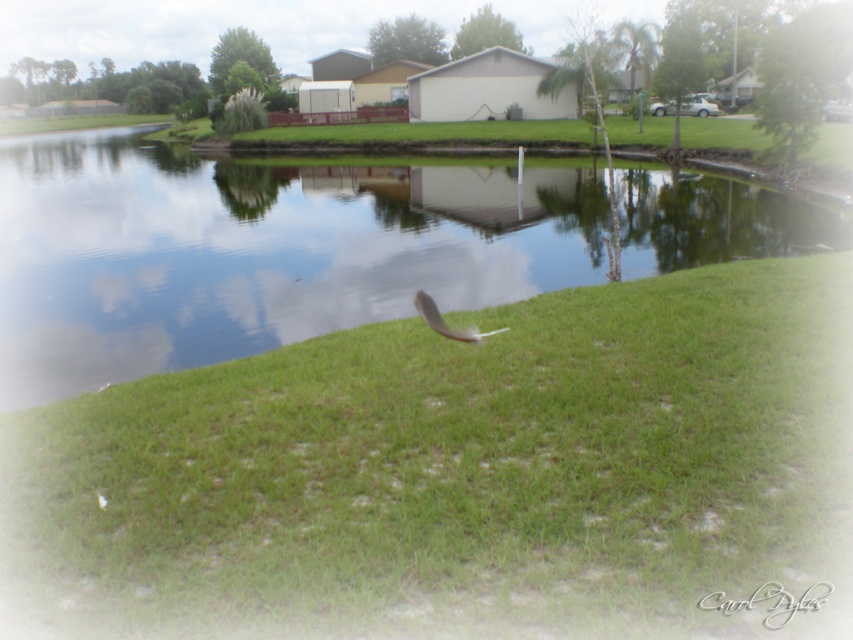
Between green grass at center and white feather at center, which one is positioned lower?

green grass at center is lower down.

This screenshot has width=853, height=640. Identify the location of green grass at center. (462, 452).

Which is behind, point (500, 205) or point (431, 307)?

Point (500, 205)

Who is more distant from viewer, (207, 172) or (440, 330)?

Point (207, 172)

You are a GUI agent. You are given a task and a screenshot of the screen. Output one action in this format:
    pyautogui.click(x=<x>, y=<y>)
    Task: Click on the transparent glass water at center
    The width and height of the screenshot is (853, 640).
    Given the screenshot: What is the action you would take?
    pyautogui.click(x=256, y=250)

Consider the image. Is green grass at center shorter than transparent glass water at center?

Indeed, green grass at center has a lesser height compared to transparent glass water at center.

Between point (781, 408) and point (164, 236), which one is positioned behind?

The point (164, 236) is more distant.

Locate an element on the screen. The height and width of the screenshot is (640, 853). green grass at center is located at coordinates (462, 452).